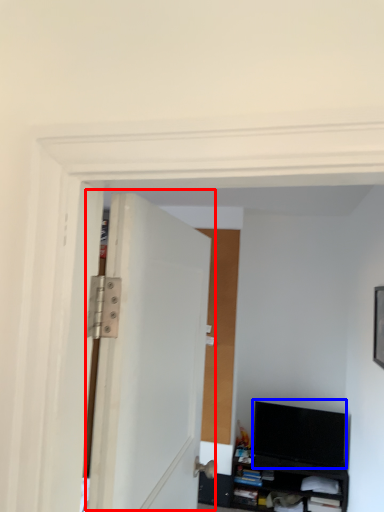
Question: Which object is further to the camera taking this photo, door (highlighted by a red box) or computer monitor (highlighted by a blue box)?

Choices:
 (A) door
 (B) computer monitor

Answer: (B)